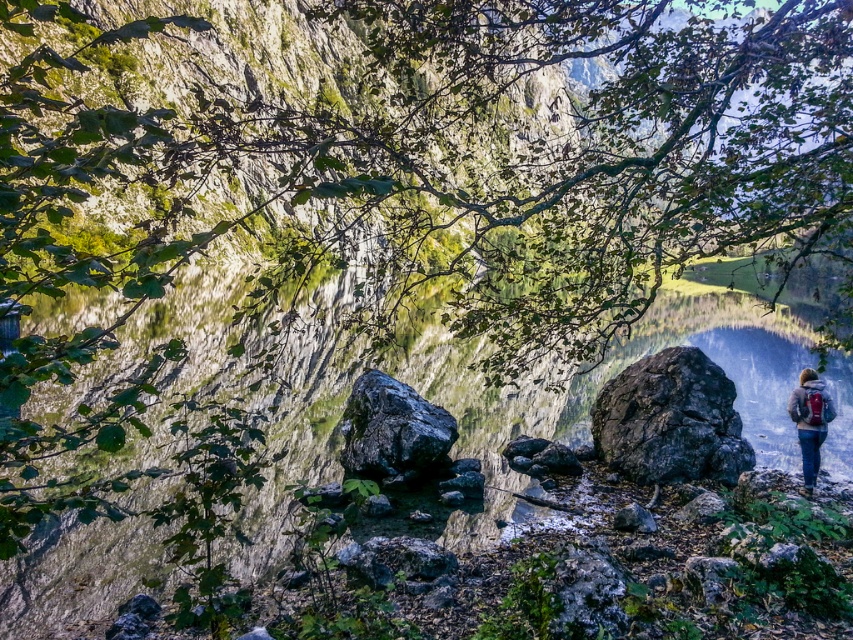
Which is below, black rough rock at center or denim jacket at lower right?

denim jacket at lower right

Which is more to the left, black rough rock at center or denim jacket at lower right?

Positioned to the left is black rough rock at center.

Find the location of a particular element. This screenshot has width=853, height=640. black rough rock at center is located at coordinates (392, 429).

From the picture: Measure the distance between dark gray rock at center and black rough rock at center.

dark gray rock at center and black rough rock at center are 11.77 feet apart from each other.

Between point (647, 483) and point (410, 458), which one is positioned behind?

The point (647, 483) is behind.

Between point (675, 348) and point (341, 461), which one is positioned in front?

Positioned in front is point (341, 461).

The image size is (853, 640). What are the coordinates of `dark gray rock at center` in the screenshot? It's located at (670, 420).

Does dark gray rock at center appear on the left side of denim jacket at lower right?

Correct, you'll find dark gray rock at center to the left of denim jacket at lower right.

Find the location of `dark gray rock at center`. dark gray rock at center is located at coordinates (670, 420).